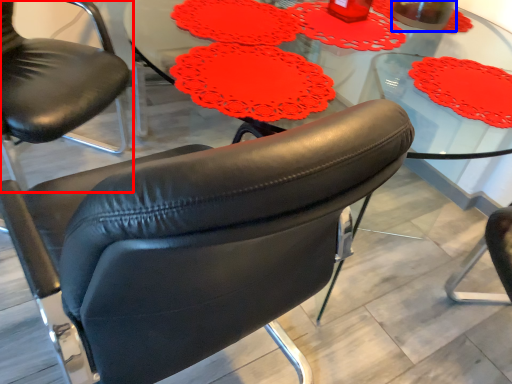
Question: Which of the following is the farthest to the observer, chair (highlighted by a red box) or beverage (highlighted by a blue box)?

Choices:
 (A) chair
 (B) beverage

Answer: (B)